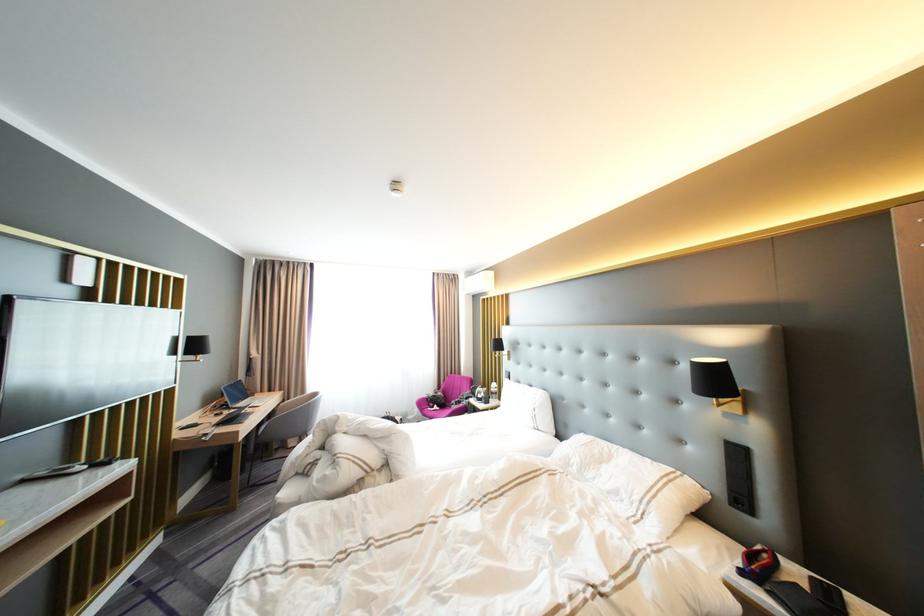
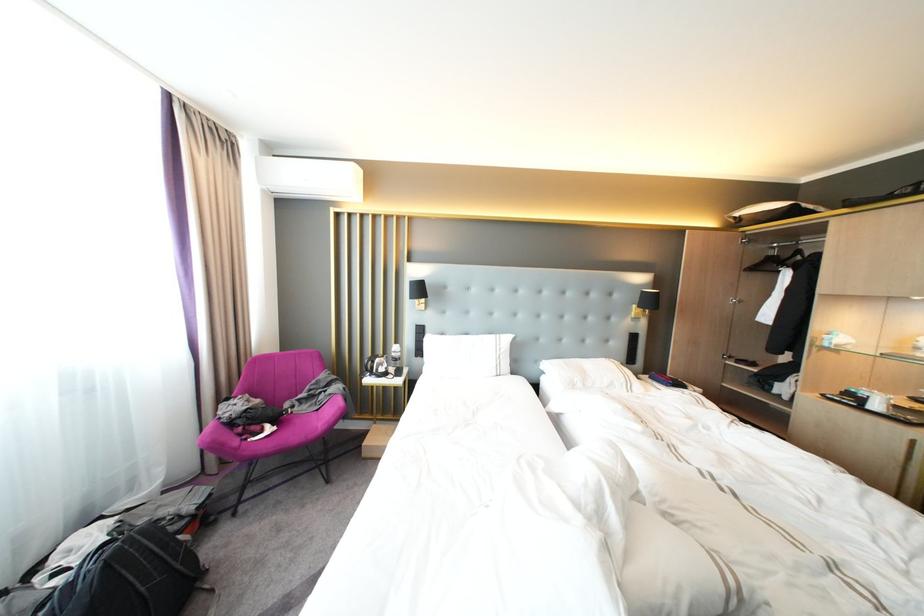
Where in the second image is the point corresponding to the point at 530,382 from the first image?

(455, 334)